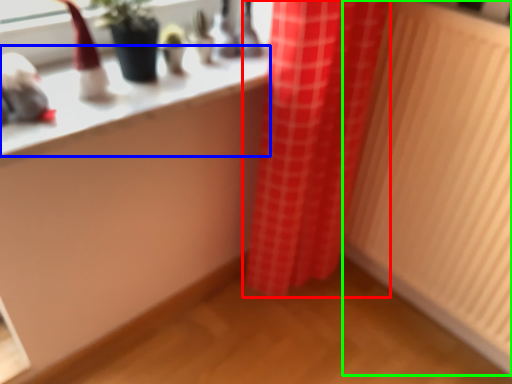
Question: Which object is the farthest from curtain (highlighted by a red box)? Choose among these: counter top (highlighted by a blue box) or radiator (highlighted by a green box).

Choices:
 (A) counter top
 (B) radiator

Answer: (A)